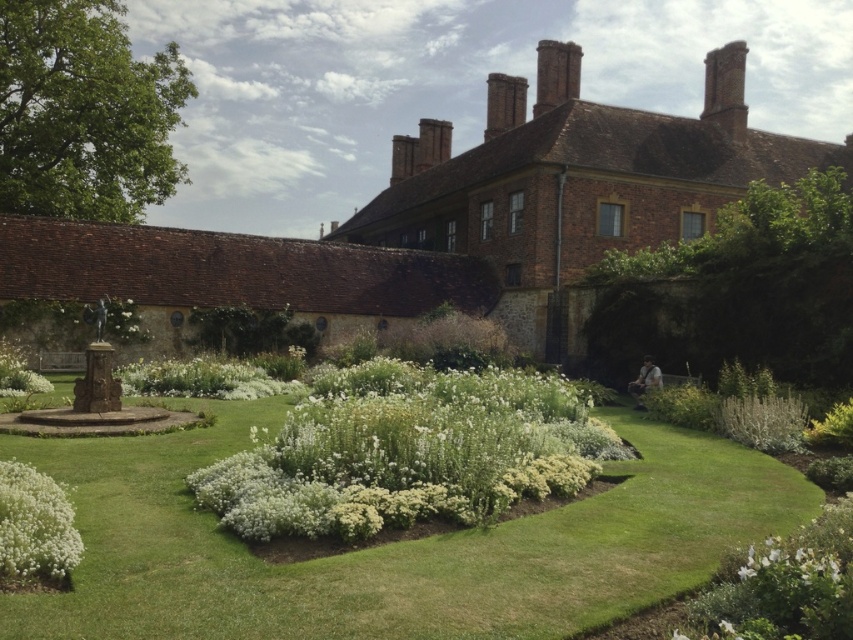
Is white fluffy bush at center smaller than white fluffy bush at lower left?

Incorrect, white fluffy bush at center is not smaller in size than white fluffy bush at lower left.

Does white fluffy bush at center appear on the right side of white fluffy bush at lower left?

Indeed, white fluffy bush at center is positioned on the right side of white fluffy bush at lower left.

Does point (379, 422) lie behind point (57, 579)?

Yes, it is behind point (57, 579).

Where is `white fluffy bush at center`? This screenshot has height=640, width=853. white fluffy bush at center is located at coordinates (407, 452).

Is the position of green grass at center less distant than that of green fuzzy bush at lower right?

That is True.

Who is positioned more to the right, green grass at center or green fuzzy bush at lower right?

Positioned to the right is green fuzzy bush at lower right.

This screenshot has width=853, height=640. I want to click on green grass at center, so click(393, 545).

You are a GUI agent. You are given a task and a screenshot of the screen. Output one action in this format:
    pyautogui.click(x=<x>, y=<y>)
    Task: Click on the green grass at center
    Image resolution: width=853 pixels, height=640 pixels.
    Given the screenshot: What is the action you would take?
    pyautogui.click(x=393, y=545)

Who is positioned more to the left, green grass at center or white matte flower at lower right?

Positioned to the left is green grass at center.

Describe the element at coordinates (393, 545) in the screenshot. I see `green grass at center` at that location.

The width and height of the screenshot is (853, 640). What are the coordinates of `green grass at center` in the screenshot? It's located at (393, 545).